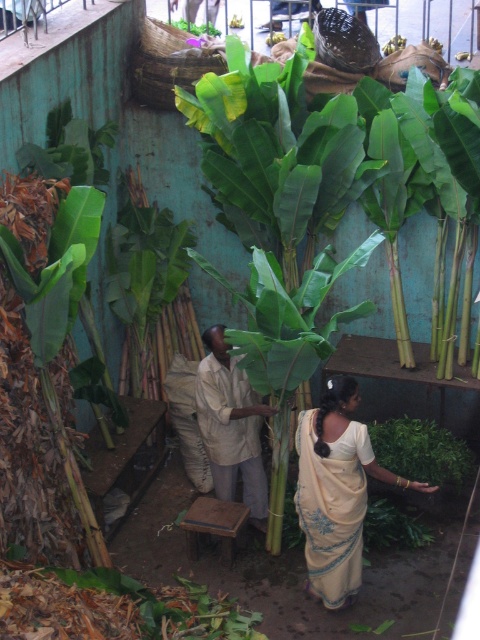
Question: Does green leafy banana tree at center have a greater width compared to beige cotton shirt at center?

Choices:
 (A) yes
 (B) no

Answer: (A)

Question: Which point is farther to the camera?

Choices:
 (A) (271, 100)
 (B) (447, 433)
 (C) (195, 29)
 (D) (200, 529)

Answer: (C)

Question: From the image, what is the correct spatial relationship of green leafy banana tree at center in relation to beige cotton shirt at center?

Choices:
 (A) right
 (B) left

Answer: (A)

Question: Which point appears closest to the camera in this image?

Choices:
 (A) (338, 541)
 (B) (218, 452)
 (C) (241, 515)

Answer: (A)

Question: Among these points, which one is farthest from the camera?

Choices:
 (A) (436, 465)
 (B) (333, 451)

Answer: (A)

Question: Does green leafy banana tree at center have a smaller size compared to green leafy plant at lower right?

Choices:
 (A) no
 (B) yes

Answer: (A)